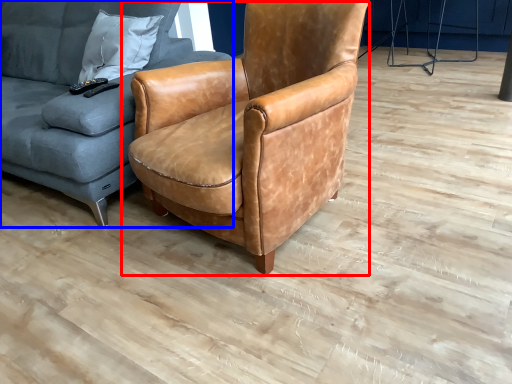
Question: Among these objects, which one is farthest to the camera, chair (highlighted by a red box) or studio couch (highlighted by a blue box)?

Choices:
 (A) chair
 (B) studio couch

Answer: (B)